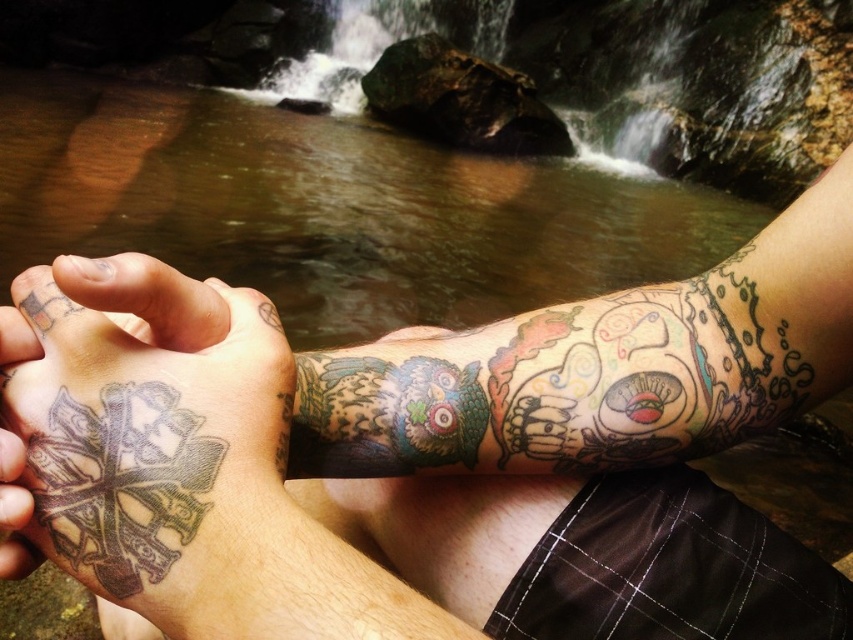
Question: Which point is closer to the camera?

Choices:
 (A) multicolored tattooed hand at lower left
 (B) gray ink tattoo at lower left

Answer: (B)

Question: Does gray ink tattoo at lower left appear over multicolored tattooed hand at lower left?

Choices:
 (A) no
 (B) yes

Answer: (A)

Question: Which of the following is the closest to the observer?

Choices:
 (A) gray ink tattoo at lower left
 (B) multicolored tattooed hand at lower left

Answer: (A)

Question: From the image, what is the correct spatial relationship of gray ink tattoo at lower left in relation to multicolored tattooed hand at lower left?

Choices:
 (A) below
 (B) above

Answer: (A)

Question: Considering the relative positions of gray ink tattoo at lower left and multicolored tattooed hand at lower left in the image provided, where is gray ink tattoo at lower left located with respect to multicolored tattooed hand at lower left?

Choices:
 (A) above
 (B) below

Answer: (B)